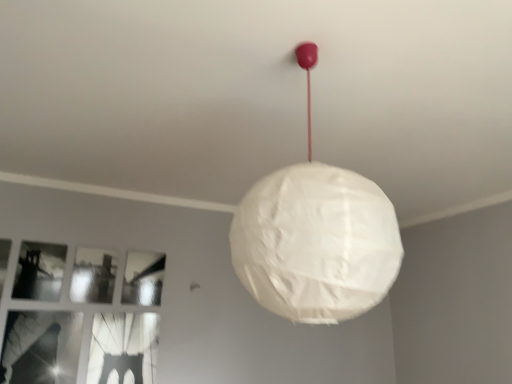
What do you see at coordinates (316, 237) in the screenshot?
I see `white paper lampshade at center` at bounding box center [316, 237].

In order to click on white paper lampshade at center in this screenshot , I will do `click(316, 237)`.

Where is `white paper lampshade at center`? The height and width of the screenshot is (384, 512). white paper lampshade at center is located at coordinates (316, 237).